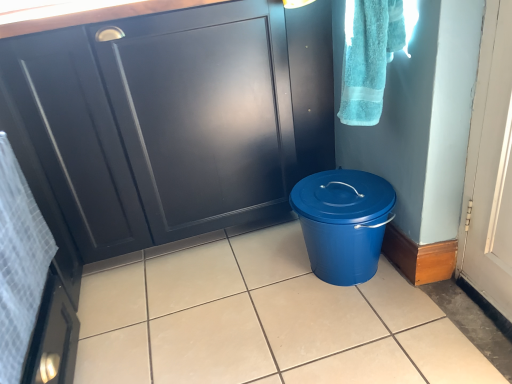
Question: Is turquoise cotton towel at upper right, the second bath towel in the bottom-to-top sequence, inside the boundaries of matte black cabinet at center, or outside?

Choices:
 (A) inside
 (B) outside

Answer: (B)

Question: Is turquoise cotton towel at upper right, marked as the 1th bath towel in a top-to-bottom arrangement, taller or shorter than matte black cabinet at center?

Choices:
 (A) tall
 (B) short

Answer: (B)

Question: Based on their relative distances, which object is farther from the white textured towel at left, the 1th bath towel in the bottom-to-top sequence?

Choices:
 (A) turquoise cotton towel at upper right, marked as the 1th bath towel in a top-to-bottom arrangement
 (B) matte black cabinet at center
 (C) blue plastic bucket at lower right
 (D) matte blue bucket at center

Answer: (A)

Question: Which of these objects is positioned farthest from the matte blue bucket at center?

Choices:
 (A) blue plastic bucket at lower right
 (B) white textured towel at left, marked as the 1th bath towel in a left-to-right arrangement
 (C) matte black cabinet at center
 (D) turquoise cotton towel at upper right, positioned as the 2th bath towel in left-to-right order

Answer: (D)